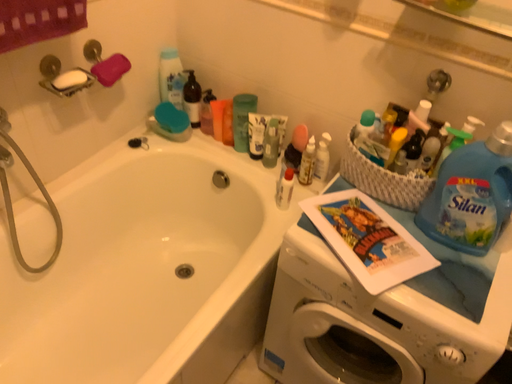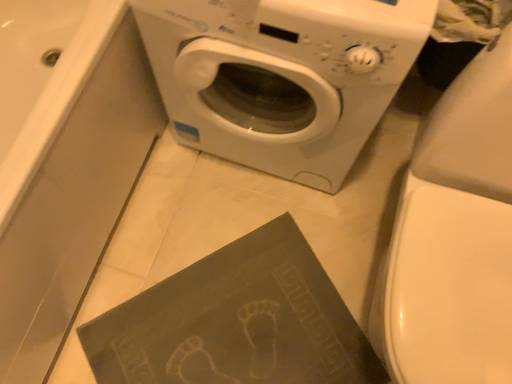
Question: How did the camera likely rotate when shooting the video?

Choices:
 (A) rotated left
 (B) rotated right

Answer: (B)